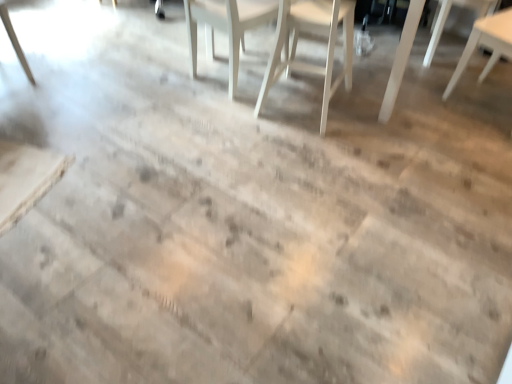
Question: Based on their positions, is white wood chair at upper right, positioned as the 1th chair in right-to-left order, located to the left or right of white wood chair at upper right, placed as the 2th chair when sorted from right to left?

Choices:
 (A) left
 (B) right

Answer: (B)

Question: In terms of width, does white wood chair at upper right, which is the 4th chair in left-to-right order, look wider or thinner when compared to white wood chair at upper right, placed as the 2th chair when sorted from right to left?

Choices:
 (A) thin
 (B) wide

Answer: (A)

Question: Considering the real-world distances, which object is farthest from the white wood chair at upper right, which is the 4th chair in left-to-right order?

Choices:
 (A) white wood chair at center, the 3th chair in the right-to-left sequence
 (B) white wood chair at center, the first chair when ordered from left to right
 (C) white wood chair at upper right, the third chair in the left-to-right sequence
 (D) light brown wood table at lower left

Answer: (D)

Question: Estimate the real-world distances between objects in this image. Which object is farther from the light brown wood table at lower left?

Choices:
 (A) white wood chair at upper right, placed as the 2th chair when sorted from right to left
 (B) white wood chair at upper right, which is the 4th chair in left-to-right order
 (C) white wood chair at center, the first chair when ordered from left to right
 (D) white wood chair at center, the 3th chair in the right-to-left sequence

Answer: (A)